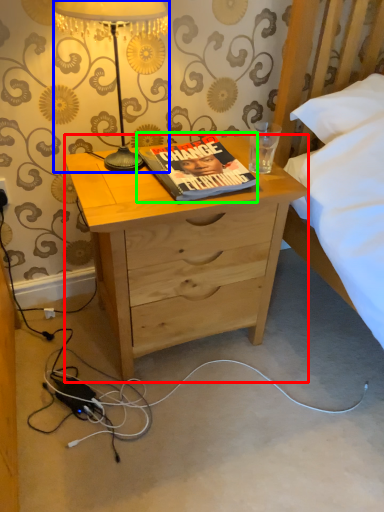
Question: Based on their relative distances, which object is farther from desk (highlighted by a red box)? Choose from lamp (highlighted by a blue box) and book (highlighted by a green box).

Choices:
 (A) lamp
 (B) book

Answer: (A)